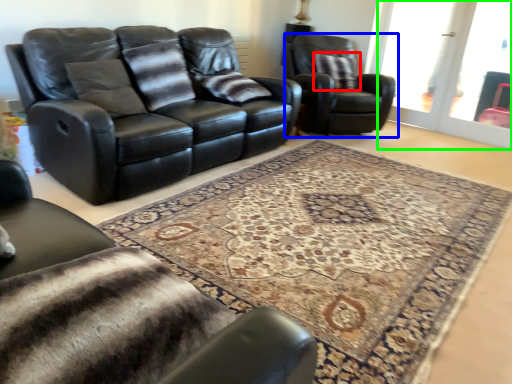
Question: Which object is positioned closest to pillow (highlighted by a red box)? Select from chair (highlighted by a blue box) and screen door (highlighted by a green box).

Choices:
 (A) chair
 (B) screen door

Answer: (A)